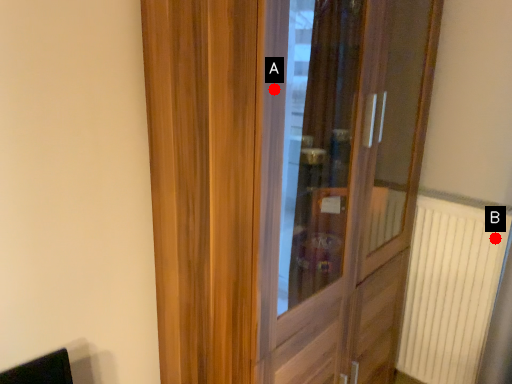
Question: Two points are circled on the image, labeled by A and B beside each circle. Among these points, which one is nearest to the camera?

Choices:
 (A) A is closer
 (B) B is closer

Answer: (A)